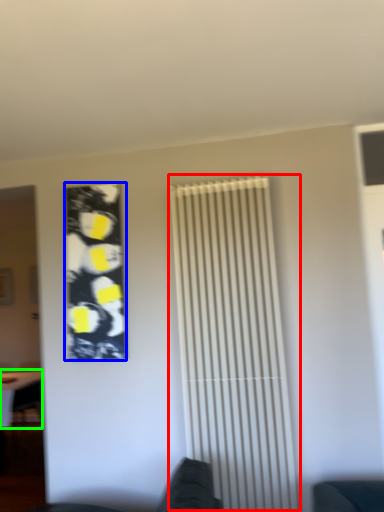
Question: Which is nearer to the shutter (highlighted by a red box)? poster (highlighted by a blue box) or table (highlighted by a green box).

Choices:
 (A) poster
 (B) table

Answer: (A)